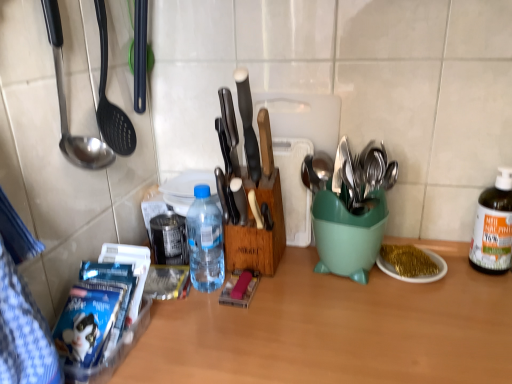
Question: Are translucent plastic bottle at center, marked as the 2th bottle in a right-to-left arrangement, and white plastic knife at center making contact?

Choices:
 (A) no
 (B) yes

Answer: (A)

Question: Is translucent plastic bottle at center, the first bottle from the left, wider than white plastic knife at center?

Choices:
 (A) yes
 (B) no

Answer: (A)

Question: Considering the relative sizes of translucent plastic bottle at center, the first bottle from the left, and white plastic knife at center in the image provided, is translucent plastic bottle at center, the first bottle from the left, bigger than white plastic knife at center?

Choices:
 (A) yes
 (B) no

Answer: (A)

Question: From a real-world perspective, is translucent plastic bottle at center, marked as the 2th bottle in a right-to-left arrangement, located higher than white plastic knife at center?

Choices:
 (A) no
 (B) yes

Answer: (A)

Question: Does translucent plastic bottle at center, marked as the 2th bottle in a right-to-left arrangement, appear on the left side of white plastic knife at center?

Choices:
 (A) no
 (B) yes

Answer: (B)

Question: Would you say translucent plastic bottle at center, marked as the 2th bottle in a right-to-left arrangement, is to the left or to the right of wooden spoon at center, which is counted as the 2th spoon, starting from the top, in the picture?

Choices:
 (A) left
 (B) right

Answer: (A)

Question: Does point (218, 236) appear closer or farther from the camera than point (241, 215)?

Choices:
 (A) closer
 (B) farther

Answer: (B)

Question: Relative to wooden spoon at center, arranged as the first spoon when ordered from the bottom, is translucent plastic bottle at center, the first bottle from the left, in front or behind?

Choices:
 (A) front
 (B) behind

Answer: (A)

Question: Choose the correct answer: Is translucent plastic bottle at center, marked as the 2th bottle in a right-to-left arrangement, inside wooden spoon at center, marked as the 1th spoon in a back-to-front arrangement, or outside it?

Choices:
 (A) outside
 (B) inside

Answer: (A)

Question: Is wooden spoon at center, the second spoon when ordered from front to back, inside the boundaries of green plastic spoon holder at right, or outside?

Choices:
 (A) outside
 (B) inside

Answer: (A)

Question: Considering the positions of point (240, 223) and point (312, 215), is point (240, 223) closer or farther from the camera than point (312, 215)?

Choices:
 (A) farther
 (B) closer

Answer: (B)

Question: Looking at their shapes, would you say wooden spoon at center, which is counted as the 1th spoon, starting from the right, is wider or thinner than green plastic spoon holder at right?

Choices:
 (A) wide
 (B) thin

Answer: (B)

Question: Would you say wooden spoon at center, the 2th spoon in the left-to-right sequence, is to the left or to the right of green plastic spoon holder at right in the picture?

Choices:
 (A) right
 (B) left

Answer: (B)

Question: In terms of height, does white plastic cutting board at center look taller or shorter compared to stainless steel spoon at left, placed as the second spoon when sorted from back to front?

Choices:
 (A) tall
 (B) short

Answer: (A)

Question: Visually, is white plastic cutting board at center positioned to the left or to the right of stainless steel spoon at left, which is counted as the 2th spoon, starting from the right?

Choices:
 (A) left
 (B) right

Answer: (B)